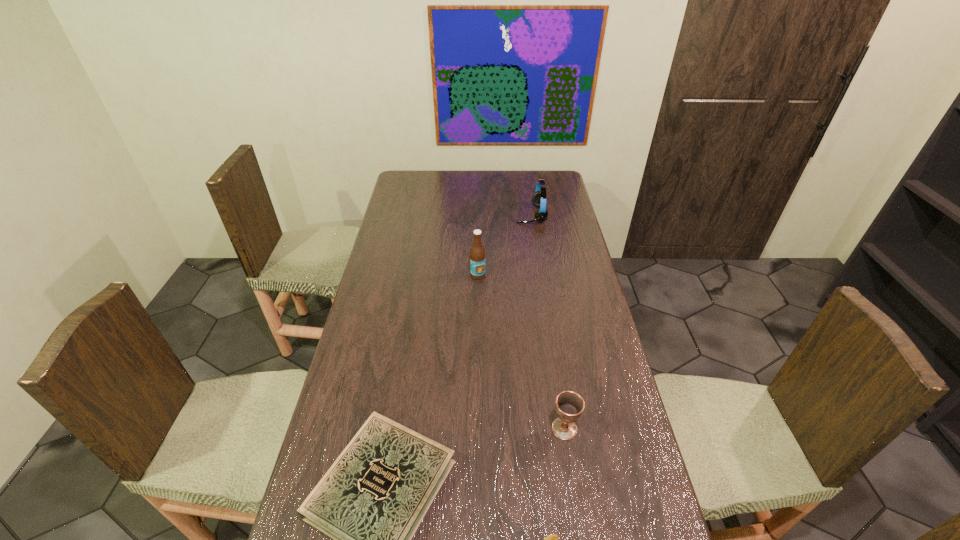
The height and width of the screenshot is (540, 960). Identify the location of vacant space that satisfies the following two spatial constraints: 1. with the microphone attached to the side of the fourth shortest object; 2. on the front side of the chalice. (564, 429).